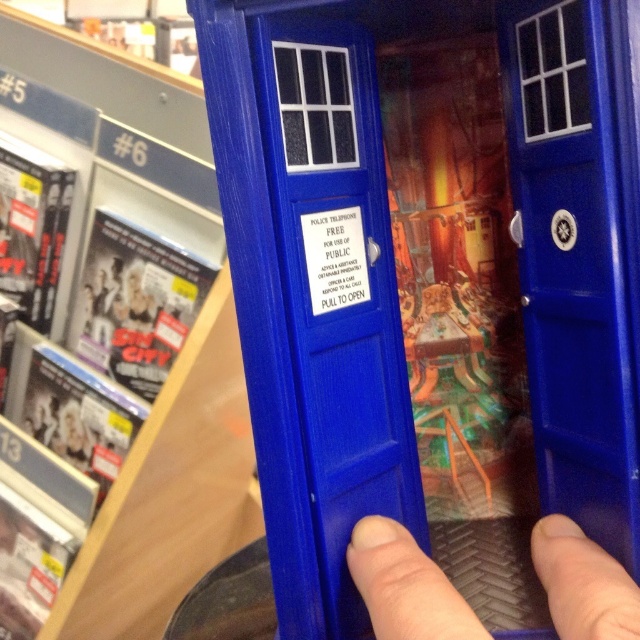
Question: In this image, where is blue plastic bookshelf at center located relative to blue plastic finger at lower center?

Choices:
 (A) above
 (B) below

Answer: (A)

Question: Is blue plastic bookshelf at center further to the viewer compared to blue plastic finger at lower center?

Choices:
 (A) no
 (B) yes

Answer: (B)

Question: Which point is closer to the camera?

Choices:
 (A) blue plastic bookshelf at center
 (B) blue plastic finger at lower center

Answer: (B)

Question: Can you confirm if blue plastic bookshelf at center is positioned below blue plastic finger at lower center?

Choices:
 (A) yes
 (B) no

Answer: (B)

Question: Which point is farther to the camera?

Choices:
 (A) blue plastic finger at lower center
 (B) blue plastic bookshelf at center

Answer: (B)